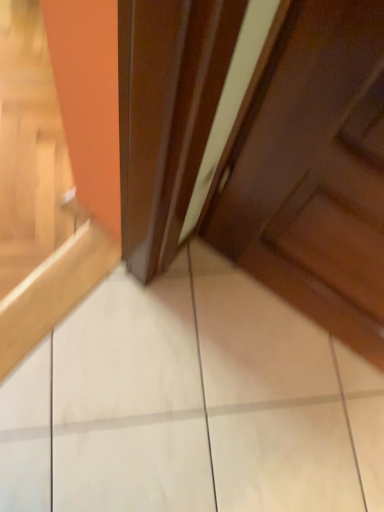
Question: Should I look upward or downward to see glossy wood door at center?

Choices:
 (A) up
 (B) down

Answer: (A)